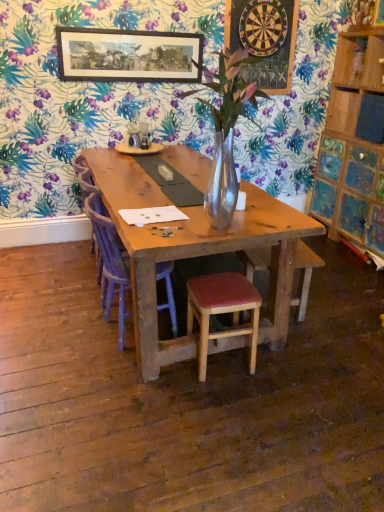
Question: Considering the relative sizes of purple fabric armchair at center and wooden stool with red cushion at center in the image provided, is purple fabric armchair at center thinner than wooden stool with red cushion at center?

Choices:
 (A) yes
 (B) no

Answer: (B)

Question: Is purple fabric armchair at center not near wooden stool with red cushion at center?

Choices:
 (A) no
 (B) yes

Answer: (A)

Question: Are purple fabric armchair at center and wooden stool with red cushion at center beside each other?

Choices:
 (A) yes
 (B) no

Answer: (B)

Question: Is purple fabric armchair at center shorter than wooden stool with red cushion at center?

Choices:
 (A) no
 (B) yes

Answer: (A)

Question: Considering the relative positions of purple fabric armchair at center and wooden stool with red cushion at center in the image provided, is purple fabric armchair at center in front of wooden stool with red cushion at center?

Choices:
 (A) yes
 (B) no

Answer: (B)

Question: Considering the relative sizes of purple fabric armchair at center and wooden stool with red cushion at center in the image provided, is purple fabric armchair at center wider than wooden stool with red cushion at center?

Choices:
 (A) no
 (B) yes

Answer: (B)

Question: Considering the relative sizes of wooden dartboard at upper center and wooden framed print at upper center in the image provided, is wooden dartboard at upper center thinner than wooden framed print at upper center?

Choices:
 (A) no
 (B) yes

Answer: (A)

Question: Is wooden dartboard at upper center outside of wooden framed print at upper center?

Choices:
 (A) no
 (B) yes

Answer: (B)

Question: Does wooden dartboard at upper center lie in front of wooden framed print at upper center?

Choices:
 (A) yes
 (B) no

Answer: (B)

Question: From a real-world perspective, is wooden dartboard at upper center beneath wooden framed print at upper center?

Choices:
 (A) yes
 (B) no

Answer: (B)

Question: From the image's perspective, does wooden dartboard at upper center appear lower than wooden framed print at upper center?

Choices:
 (A) no
 (B) yes

Answer: (A)

Question: Can you confirm if wooden dartboard at upper center is positioned to the left of wooden framed print at upper center?

Choices:
 (A) yes
 (B) no

Answer: (B)

Question: Is wooden stool with red cushion at center a part of wooden framed print at upper center?

Choices:
 (A) yes
 (B) no

Answer: (B)